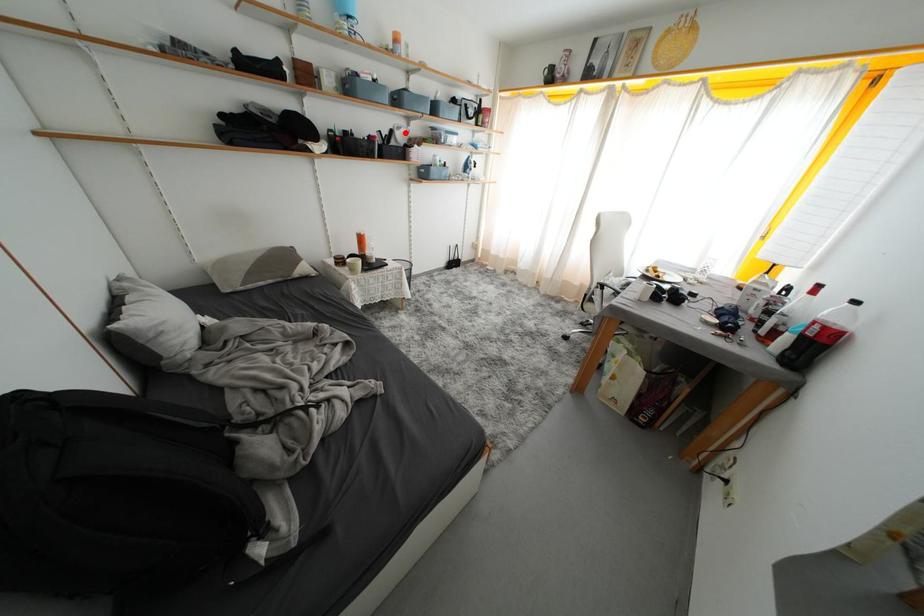
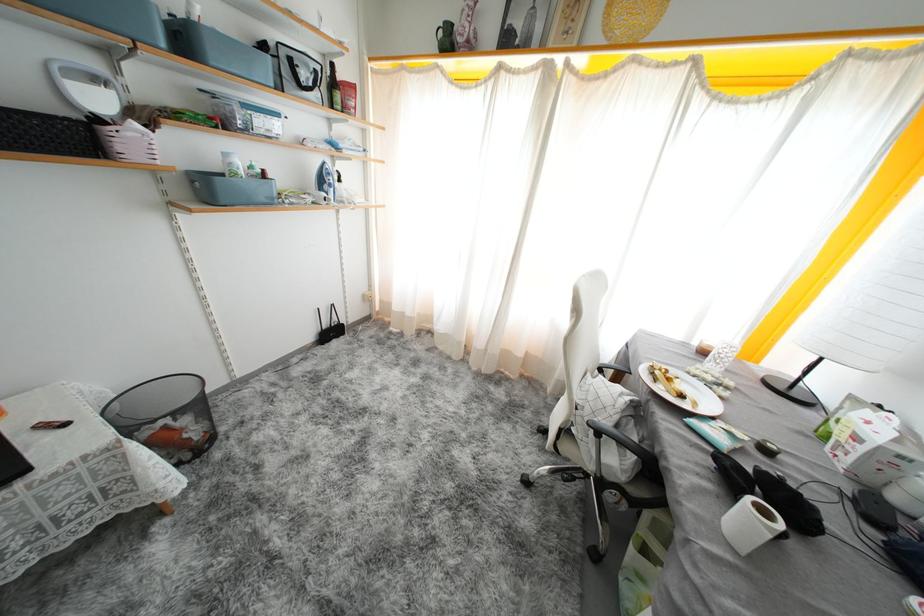
Locate, in the second image, the point that corresponds to the highlighted location in the first image.

(103, 84)